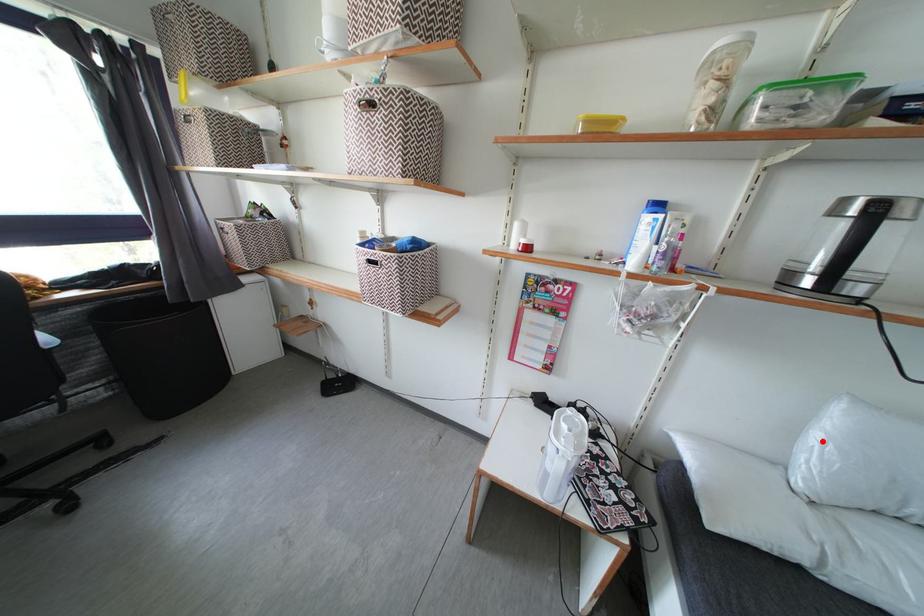
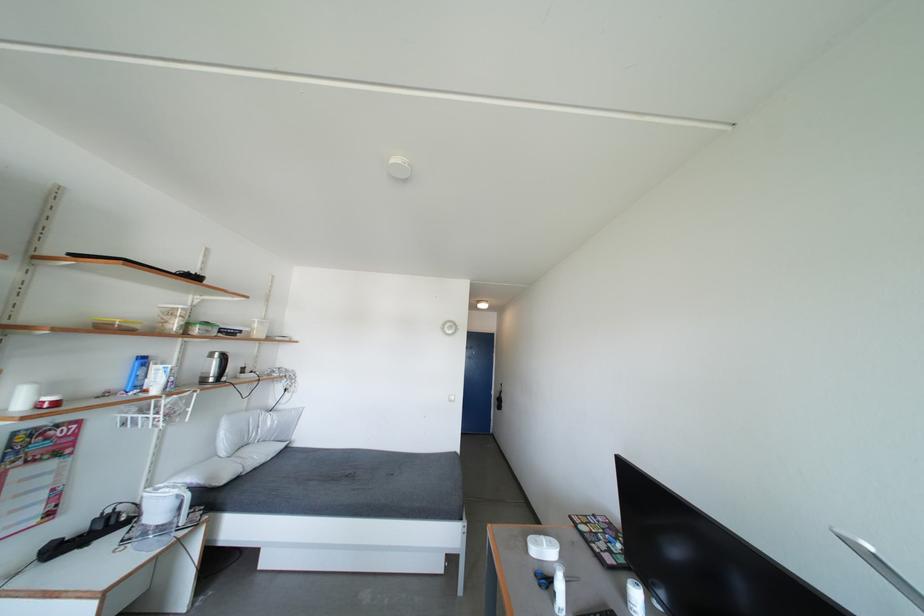
Where in the second image is the point corresponding to the highlighted location from the first image?

(228, 439)